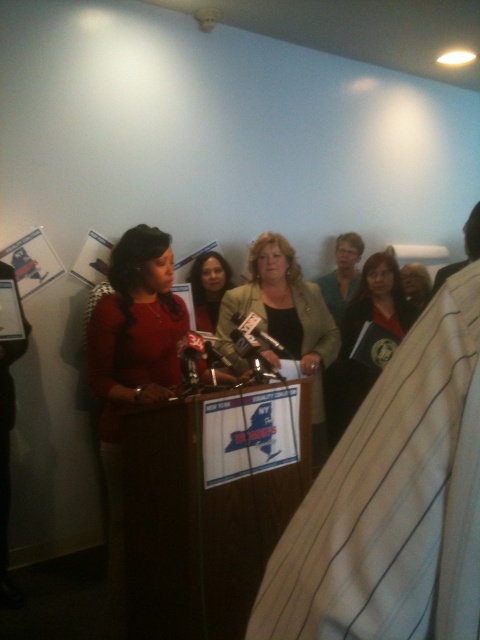
Can you confirm if matte black folder at center is bigger than matte black jacket at center?

Actually, matte black folder at center might be smaller than matte black jacket at center.

Can you confirm if matte black folder at center is positioned to the left of matte black jacket at center?

Correct, you'll find matte black folder at center to the left of matte black jacket at center.

This screenshot has height=640, width=480. Find the location of `matte black folder at center`. matte black folder at center is located at coordinates (374, 328).

Who is more forward, [335,248] or [415,305]?

Point [415,305]

Is teal fabric shirt at center further to camera compared to matte black jacket at center?

Yes, it is behind matte black jacket at center.

What do you see at coordinates (342, 275) in the screenshot? The image size is (480, 640). I see `teal fabric shirt at center` at bounding box center [342, 275].

The height and width of the screenshot is (640, 480). Find the location of `teal fabric shirt at center`. teal fabric shirt at center is located at coordinates (342, 275).

Who is lower down, matte black hair at center or teal fabric shirt at center?

Positioned lower is matte black hair at center.

Is matte black hair at center wider than teal fabric shirt at center?

No, matte black hair at center is not wider than teal fabric shirt at center.

From the picture: Who is more forward, (193, 266) or (337, 266)?

Positioned in front is point (193, 266).

Where is `matte black hair at center`? The image size is (480, 640). matte black hair at center is located at coordinates (208, 288).